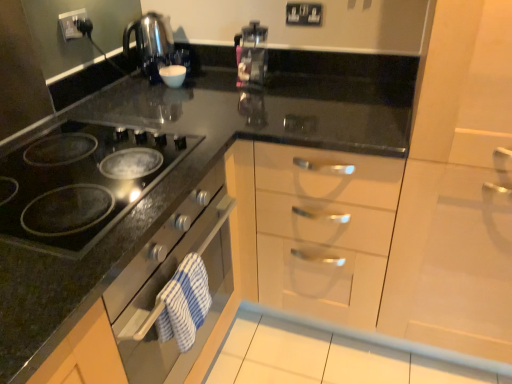
The image size is (512, 384). What do you see at coordinates (73, 24) in the screenshot?
I see `black plastic electric outlet at upper left, the first electric outlet positioned from the front` at bounding box center [73, 24].

What is the approximate height of white glossy drawer at center?

It is 98.43 centimeters.

Identify the location of white glossy drawer at center. The height and width of the screenshot is (384, 512). (324, 230).

Locate an element on the screen. transparent plastic coffee machine at center is located at coordinates (252, 54).

Find the location of a particular element. Image resolution: width=512 pixels, height=384 pixels. black plastic electric outlet at upper center, the first electric outlet in the right-to-left sequence is located at coordinates (303, 14).

Can you confirm if white glossy cabinet at right is thinner than black plastic electric outlet at upper center, the first electric outlet in the right-to-left sequence?

Incorrect, the width of white glossy cabinet at right is not less than that of black plastic electric outlet at upper center, the first electric outlet in the right-to-left sequence.

Measure the distance from white glossy cabinet at right to black plastic electric outlet at upper center, marked as the 2th electric outlet in a front-to-back arrangement.

The distance of white glossy cabinet at right from black plastic electric outlet at upper center, marked as the 2th electric outlet in a front-to-back arrangement, is 35.93 inches.

Which object is closer to the camera taking this photo, white glossy cabinet at right or black plastic electric outlet at upper center, the first electric outlet in the right-to-left sequence?

Positioned in front is white glossy cabinet at right.

Considering the relative sizes of white glossy cabinet at right and black plastic electric outlet at upper center, positioned as the 1th electric outlet in back-to-front order, in the image provided, is white glossy cabinet at right bigger than black plastic electric outlet at upper center, positioned as the 1th electric outlet in back-to-front order,?

Correct, white glossy cabinet at right is larger in size than black plastic electric outlet at upper center, positioned as the 1th electric outlet in back-to-front order.

Measure the distance between white glossy drawer at center and black plastic electric outlet at upper left, acting as the 2th electric outlet starting from the right.

white glossy drawer at center and black plastic electric outlet at upper left, acting as the 2th electric outlet starting from the right, are 1.10 meters apart from each other.

From a real-world perspective, is white glossy drawer at center positioned above or below black plastic electric outlet at upper left, which is counted as the first electric outlet, starting from the left?

In terms of real-world spatial position, white glossy drawer at center is below black plastic electric outlet at upper left, which is counted as the first electric outlet, starting from the left.

Is white glossy drawer at center looking in the opposite direction of black plastic electric outlet at upper left, acting as the 2th electric outlet starting from the right?

No, white glossy drawer at center is not facing away from black plastic electric outlet at upper left, acting as the 2th electric outlet starting from the right.

Which object is further away from the camera taking this photo, white glossy drawer at center or black plastic electric outlet at upper left, which is counted as the first electric outlet, starting from the left?

black plastic electric outlet at upper left, which is counted as the first electric outlet, starting from the left, is further from the camera.

Who is taller, white glossy cabinet at right or transparent plastic coffee machine at center?

white glossy cabinet at right is taller.

Does white glossy cabinet at right appear on the left side of transparent plastic coffee machine at center?

No, white glossy cabinet at right is not to the left of transparent plastic coffee machine at center.

Consider the image. Is white glossy cabinet at right completely or partially outside of transparent plastic coffee machine at center?

white glossy cabinet at right is positioned outside transparent plastic coffee machine at center.

Looking at this image, considering the sizes of objects white glossy cabinet at right and transparent plastic coffee machine at center in the image provided, who is bigger, white glossy cabinet at right or transparent plastic coffee machine at center?

white glossy cabinet at right.

What's the angular difference between black glass cooktop at left and white glossy cabinet at right's facing directions?

90.3 degrees separate the facing orientations of black glass cooktop at left and white glossy cabinet at right.

From a real-world perspective, is black glass cooktop at left physically located above or below white glossy cabinet at right?

Clearly, from a real-world perspective, black glass cooktop at left is above white glossy cabinet at right.

You are a GUI agent. You are given a task and a screenshot of the screen. Output one action in this format:
    pyautogui.click(x=<x>, y=<y>)
    Task: Click on the gas stove on the left of the white glossy cabinet at right
    Image resolution: width=512 pixels, height=384 pixels.
    Given the screenshot: What is the action you would take?
    pyautogui.click(x=81, y=183)

Measure the distance between black glass cooktop at left and white glossy cabinet at right.

A distance of 34.18 inches exists between black glass cooktop at left and white glossy cabinet at right.

Is black plastic electric outlet at upper center, positioned as the 1th electric outlet in back-to-front order, located within white glossy drawer at center?

Actually, black plastic electric outlet at upper center, positioned as the 1th electric outlet in back-to-front order, is outside white glossy drawer at center.

Is white glossy drawer at center positioned with its back to black plastic electric outlet at upper center, positioned as the 1th electric outlet in back-to-front order?

That's not correct — white glossy drawer at center is not looking away from black plastic electric outlet at upper center, positioned as the 1th electric outlet in back-to-front order.

Is the surface of white glossy drawer at center in direct contact with black plastic electric outlet at upper center, positioned as the 1th electric outlet in back-to-front order?

No.

In the scene shown: Between white glossy drawer at center and black plastic electric outlet at upper center, marked as the 2th electric outlet in a front-to-back arrangement, which one is positioned in front?

Positioned in front is white glossy drawer at center.

Does black plastic electric outlet at upper center, marked as the 2th electric outlet in a front-to-back arrangement, appear on the right side of black plastic electric outlet at upper left, the first electric outlet positioned from the front?

Indeed, black plastic electric outlet at upper center, marked as the 2th electric outlet in a front-to-back arrangement, is positioned on the right side of black plastic electric outlet at upper left, the first electric outlet positioned from the front.

In the scene shown: From a real-world perspective, is black plastic electric outlet at upper center, the first electric outlet in the right-to-left sequence, below black plastic electric outlet at upper left, acting as the 2th electric outlet starting from the right?

Yes, from a real-world perspective, black plastic electric outlet at upper center, the first electric outlet in the right-to-left sequence, is below black plastic electric outlet at upper left, acting as the 2th electric outlet starting from the right.

Based on their sizes in the image, would you say black plastic electric outlet at upper center, the first electric outlet in the right-to-left sequence, is bigger or smaller than black plastic electric outlet at upper left, the first electric outlet positioned from the front?

Considering their sizes, black plastic electric outlet at upper center, the first electric outlet in the right-to-left sequence, takes up more space than black plastic electric outlet at upper left, the first electric outlet positioned from the front.

Could you tell me if black plastic electric outlet at upper center, marked as the 2th electric outlet in a front-to-back arrangement, is turned towards black plastic electric outlet at upper left, the first electric outlet positioned from the front?

No.

Based on the photo, from the image's perspective, between transparent plastic coffee machine at center and white glossy cabinet at right, which one is located above?

transparent plastic coffee machine at center is shown above in the image.

Considering the points (252, 39) and (449, 333), which point is behind, point (252, 39) or point (449, 333)?

Point (252, 39)

In the scene shown: Which is in front, transparent plastic coffee machine at center or white glossy cabinet at right?

Positioned in front is white glossy cabinet at right.

Image resolution: width=512 pixels, height=384 pixels. What are the coordinates of `coffee machine on the left of white glossy cabinet at right` in the screenshot? It's located at (252, 54).

I want to click on electric outlet that is the 1st one above the white glossy cabinet at right (from a real-world perspective), so click(303, 14).

At what (x,y) coordinates should I click in order to perform the action: click on drawer on the right of the black plastic electric outlet at upper left, acting as the 2th electric outlet starting from the right. Please return your answer as a coordinate pair (x, y). Looking at the image, I should click on click(x=324, y=230).

Looking at the image, which one is located further to white glossy drawer at center, black plastic electric outlet at upper center, the first electric outlet in the right-to-left sequence, or transparent plastic coffee machine at center?

Among the two, black plastic electric outlet at upper center, the first electric outlet in the right-to-left sequence, is located further to white glossy drawer at center.

Based on their spatial positions, is transparent plastic coffee machine at center or black glass cooktop at left further from white glossy drawer at center?

Among the two, transparent plastic coffee machine at center is located further to white glossy drawer at center.

Consider the image. Which object lies nearer to the anchor point white glossy drawer at center, transparent plastic coffee machine at center or white glossy cabinet at right?

white glossy cabinet at right is closer to white glossy drawer at center.

When comparing their distances from black glass cooktop at left, does white glossy drawer at center or transparent plastic coffee machine at center seem closer?

white glossy drawer at center is positioned closer to the anchor black glass cooktop at left.

Based on the photo, based on their spatial positions, is black plastic electric outlet at upper center, positioned as the 1th electric outlet in back-to-front order, or black plastic electric outlet at upper left, placed as the second electric outlet when sorted from back to front, closer to white glossy cabinet at right?

Among the two, black plastic electric outlet at upper center, positioned as the 1th electric outlet in back-to-front order, is located nearer to white glossy cabinet at right.

Considering their positions, is white glossy cabinet at right positioned closer to black glass cooktop at left than black plastic electric outlet at upper left, the first electric outlet positioned from the front?

black plastic electric outlet at upper left, the first electric outlet positioned from the front.

From the image, which object appears to be farther from black plastic electric outlet at upper center, the 2th electric outlet positioned from the left, black plastic electric outlet at upper left, acting as the 2th electric outlet starting from the right, or white glossy cabinet at right?

Based on the image, white glossy cabinet at right appears to be further to black plastic electric outlet at upper center, the 2th electric outlet positioned from the left.

From the picture: Looking at the image, which one is located further to white glossy cabinet at right, black plastic electric outlet at upper center, the 2th electric outlet positioned from the left, or white glossy drawer at center?

black plastic electric outlet at upper center, the 2th electric outlet positioned from the left, lies further to white glossy cabinet at right than the other object.

Identify the location of electric outlet located between black glass cooktop at left and white glossy drawer at center in the left-right direction. [x=303, y=14].

Where is `coffee machine between black glass cooktop at left and white glossy cabinet at right from left to right`? The image size is (512, 384). coffee machine between black glass cooktop at left and white glossy cabinet at right from left to right is located at coordinates click(252, 54).

Find the location of `coffee machine between black plastic electric outlet at upper center, the 2th electric outlet positioned from the left, and white glossy drawer at center, in the vertical direction`. coffee machine between black plastic electric outlet at upper center, the 2th electric outlet positioned from the left, and white glossy drawer at center, in the vertical direction is located at coordinates (252, 54).

The image size is (512, 384). What are the coordinates of `electric outlet between black plastic electric outlet at upper left, which is counted as the first electric outlet, starting from the left, and white glossy drawer at center from left to right` in the screenshot? It's located at (303, 14).